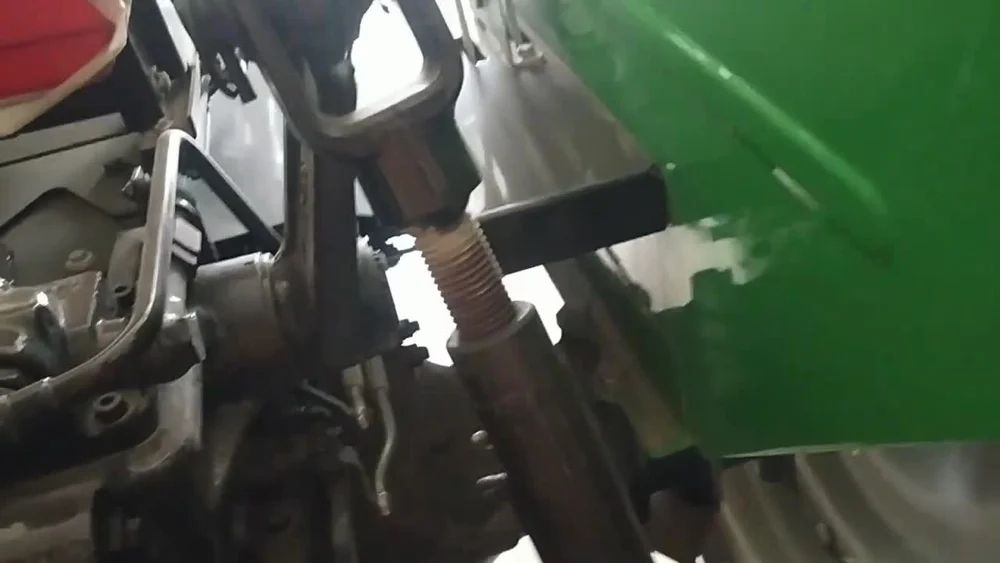
Locate an element on the screen. This screenshot has width=1000, height=563. floor is located at coordinates (384, 41).